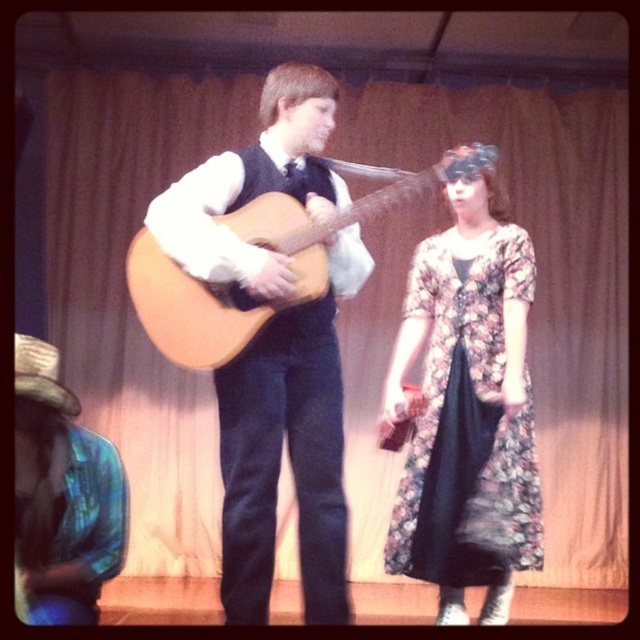
Is matte brown guitar at center smaller than light brown acoustic guitar at center?

Yes, matte brown guitar at center is smaller than light brown acoustic guitar at center.

Based on the photo, which is more to the left, matte brown guitar at center or light brown acoustic guitar at center?

From the viewer's perspective, matte brown guitar at center appears more on the left side.

Between point (317, 200) and point (417, 173), which one is positioned in front?

Point (317, 200) is more forward.

The image size is (640, 640). I want to click on matte brown guitar at center, so click(x=289, y=451).

Does matte brown guitar at center have a lesser height compared to blue fabric hat at lower left?

No.

Locate an element on the screen. The width and height of the screenshot is (640, 640). matte brown guitar at center is located at coordinates (289, 451).

Between light brown acoustic guitar at center and blue fabric hat at lower left, which one appears on the right side from the viewer's perspective?

Positioned to the right is light brown acoustic guitar at center.

Looking at this image, can you confirm if light brown acoustic guitar at center is positioned below blue fabric hat at lower left?

Actually, light brown acoustic guitar at center is above blue fabric hat at lower left.

Who is more forward, (x=436, y=177) or (x=65, y=547)?

Positioned in front is point (x=65, y=547).

You are a GUI agent. You are given a task and a screenshot of the screen. Output one action in this format:
    pyautogui.click(x=<x>, y=<y>)
    Task: Click on the light brown acoustic guitar at center
    Image resolution: width=640 pixels, height=640 pixels.
    Given the screenshot: What is the action you would take?
    pyautogui.click(x=264, y=248)